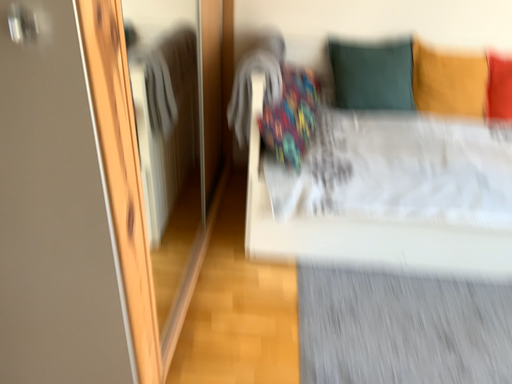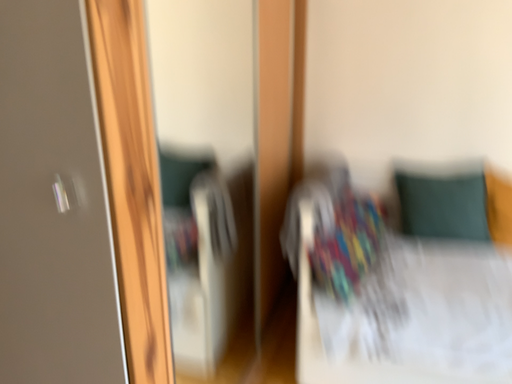
Question: How did the camera likely rotate when shooting the video?

Choices:
 (A) rotated right
 (B) rotated left

Answer: (B)